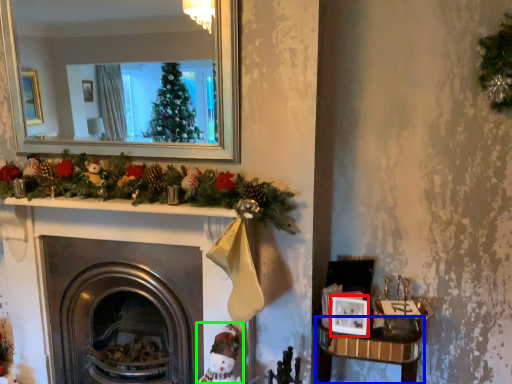
Question: Based on their relative distances, which object is farther from picture frame (highlighted by a red box)? Choose from table (highlighted by a blue box) and toy (highlighted by a green box).

Choices:
 (A) table
 (B) toy

Answer: (B)